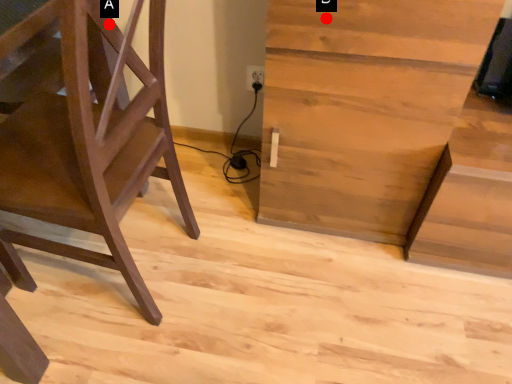
Question: Two points are circled on the image, labeled by A and B beside each circle. Among these points, which one is nearest to the camera?

Choices:
 (A) A is closer
 (B) B is closer

Answer: (A)